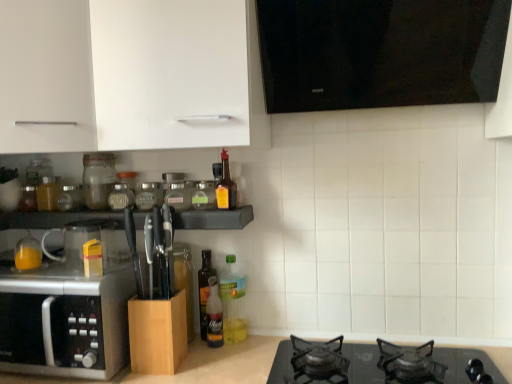
Question: Which direction should I rotate to look at translucent plastic bottle at center, which ranks as the 1th bottle in right-to-left order, — up or down?

Choices:
 (A) down
 (B) up

Answer: (A)

Question: From the image's perspective, is transparent glass jar at center, the 3th glass jar when ordered from left to right, on top of black glossy vent at upper center?

Choices:
 (A) yes
 (B) no

Answer: (B)

Question: From a real-world perspective, is transparent glass jar at center, the 3th glass jar when ordered from left to right, on top of black glossy vent at upper center?

Choices:
 (A) yes
 (B) no

Answer: (B)

Question: From a real-world perspective, is transparent glass jar at center, the 3th glass jar when ordered from left to right, located beneath black glossy vent at upper center?

Choices:
 (A) no
 (B) yes

Answer: (B)

Question: Is transparent glass jar at center, the first glass jar viewed from the right, positioned far away from black glossy vent at upper center?

Choices:
 (A) yes
 (B) no

Answer: (B)

Question: Can we say transparent glass jar at center, the first glass jar viewed from the right, lies outside black glossy vent at upper center?

Choices:
 (A) no
 (B) yes

Answer: (B)

Question: Is transparent glass jar at center, the first glass jar viewed from the right, thinner than black glossy vent at upper center?

Choices:
 (A) no
 (B) yes

Answer: (B)

Question: Is translucent plastic bottle at center, which appears as the 6th bottle when viewed from the left, not near transparent glass jar at center, the third glass jar positioned from the right?

Choices:
 (A) no
 (B) yes

Answer: (A)

Question: Is translucent plastic bottle at center, which appears as the 6th bottle when viewed from the left, smaller than transparent glass jar at center, the third glass jar positioned from the right?

Choices:
 (A) no
 (B) yes

Answer: (A)

Question: Can you confirm if translucent plastic bottle at center, which appears as the 6th bottle when viewed from the left, is bigger than transparent glass jar at center, the third glass jar positioned from the right?

Choices:
 (A) yes
 (B) no

Answer: (A)

Question: From a real-world perspective, is translucent plastic bottle at center, which ranks as the 1th bottle in right-to-left order, located higher than transparent glass jar at center, which appears as the 1th glass jar when viewed from the left?

Choices:
 (A) no
 (B) yes

Answer: (A)

Question: Does translucent plastic bottle at center, which appears as the 6th bottle when viewed from the left, appear on the right side of transparent glass jar at center, the third glass jar positioned from the right?

Choices:
 (A) no
 (B) yes

Answer: (B)

Question: From a real-world perspective, is translucent plastic bottle at center, which ranks as the 1th bottle in right-to-left order, positioned under transparent glass jar at center, the third glass jar positioned from the right, based on gravity?

Choices:
 (A) yes
 (B) no

Answer: (A)

Question: Is transparent glass jar at center, positioned as the second glass jar in left-to-right order, positioned in front of wooden knife block at center?

Choices:
 (A) no
 (B) yes

Answer: (A)